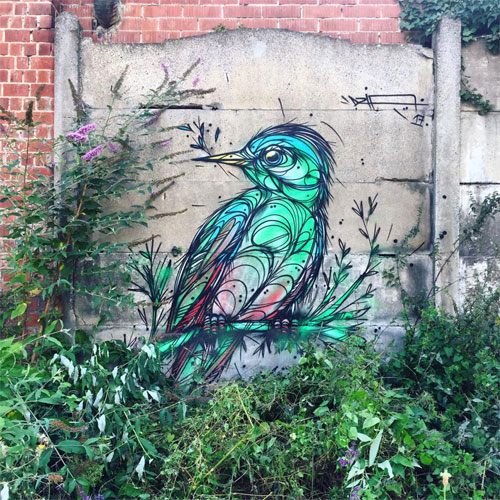
You are a GUI agent. You are given a task and a screenshot of the screen. Output one action in this format:
    pyautogui.click(x=<x>, y=<y>)
    Task: Click on the large plant against the wall
    This screenshot has height=500, width=500.
    Given the screenshot: What is the action you would take?
    pyautogui.click(x=75, y=224)